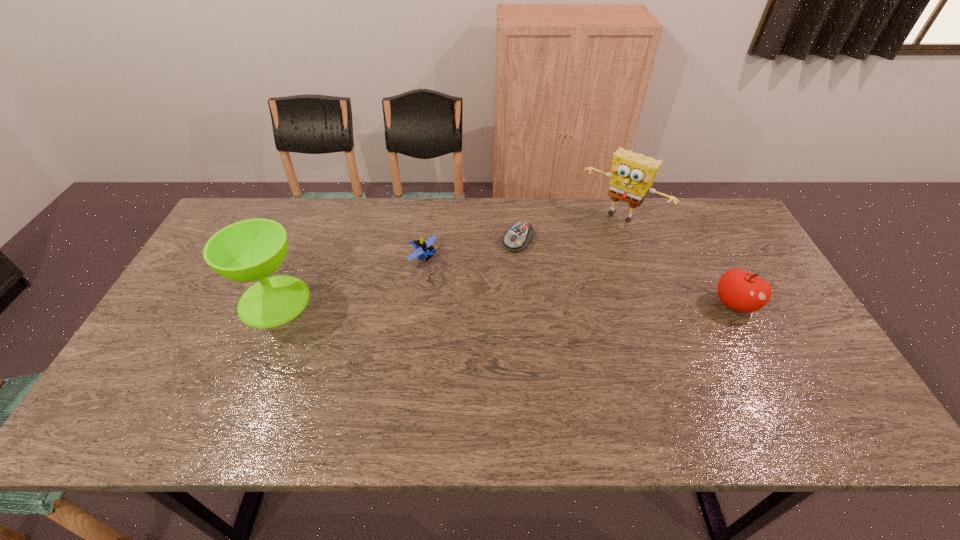
At what (x,y) coordinates should I click in order to perform the action: click on vacant position located on the front-facing side of the Lego. Please return your answer as a coordinate pair (x, y). The height and width of the screenshot is (540, 960). Looking at the image, I should click on (529, 312).

Locate an element on the screen. The height and width of the screenshot is (540, 960). free location located on the front-facing side of the Lego is located at coordinates (483, 288).

You are a GUI agent. You are given a task and a screenshot of the screen. Output one action in this format:
    pyautogui.click(x=<x>, y=<y>)
    Task: Click on the vacant space located 0.150m on the front-facing side of the Lego
    The image size is (960, 540).
    Given the screenshot: What is the action you would take?
    point(475,284)

Where is `vacant space located on the face of the fourth object from left to right`? The height and width of the screenshot is (540, 960). vacant space located on the face of the fourth object from left to right is located at coordinates (587, 251).

The width and height of the screenshot is (960, 540). I want to click on blank space located 0.330m on the face of the fourth object from left to right, so tap(551, 294).

Identify the location of vacant area located on the face of the fourth object from left to right. (568, 273).

This screenshot has height=540, width=960. In order to click on free spot located on the wheel side of the shortest object in this screenshot , I will do `click(468, 310)`.

The height and width of the screenshot is (540, 960). Identify the location of vacant area located on the wheel side of the shortest object. (450, 337).

Image resolution: width=960 pixels, height=540 pixels. Find the location of `free space located 0.350m on the wheel side of the shortest object`. free space located 0.350m on the wheel side of the shortest object is located at coordinates (454, 332).

The height and width of the screenshot is (540, 960). In order to click on Lego at the far edge in this screenshot , I will do `click(423, 248)`.